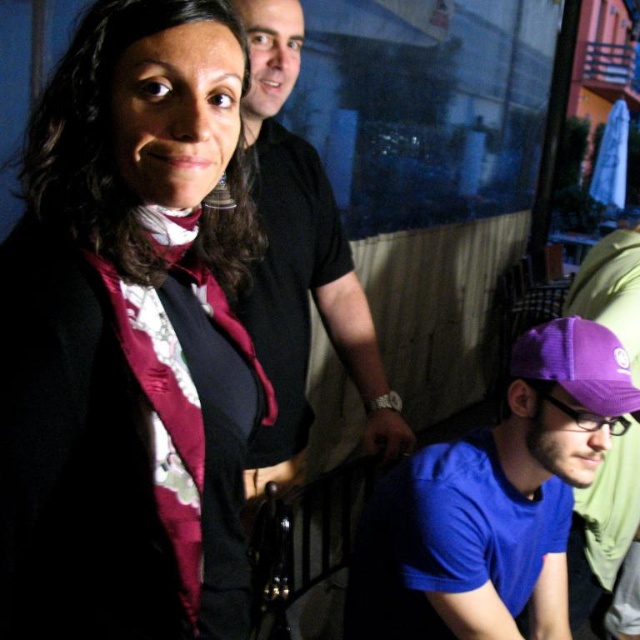
Question: Which point is farther to the camera?

Choices:
 (A) (604, 342)
 (B) (131, 92)
 (C) (268, 349)
 (D) (481, 445)

Answer: (C)

Question: Considering the real-world distances, which object is farthest from the satin floral blouse at upper left?

Choices:
 (A) black smooth shirt at upper center
 (B) purple mesh cap at lower right
 (C) purple mesh baseball cap at lower right

Answer: (C)

Question: Is purple mesh cap at lower right below purple fabric cap at lower right?

Choices:
 (A) yes
 (B) no

Answer: (A)

Question: Can you confirm if purple mesh cap at lower right is positioned to the left of purple fabric cap at lower right?

Choices:
 (A) no
 (B) yes

Answer: (B)

Question: Which of the following is the closest to the observer?

Choices:
 (A) black smooth shirt at upper center
 (B) purple mesh cap at lower right

Answer: (A)

Question: Is satin floral blouse at upper left smaller than black smooth shirt at upper center?

Choices:
 (A) no
 (B) yes

Answer: (B)